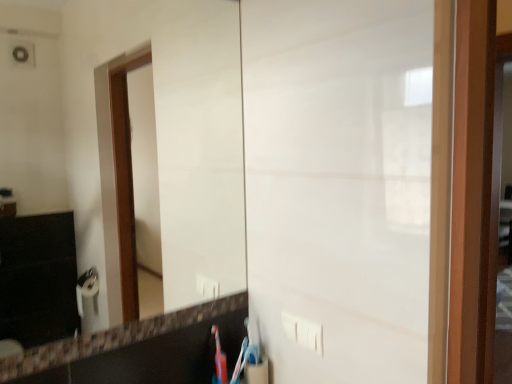
Question: From a real-world perspective, is blue plastic toothbrush at lower center located higher than white plastic electric outlet at lower center?

Choices:
 (A) yes
 (B) no

Answer: (B)

Question: Is blue plastic toothbrush at lower center far from white plastic electric outlet at lower center?

Choices:
 (A) no
 (B) yes

Answer: (A)

Question: Considering the relative positions of blue plastic toothbrush at lower center and white plastic electric outlet at lower center in the image provided, is blue plastic toothbrush at lower center to the left of white plastic electric outlet at lower center from the viewer's perspective?

Choices:
 (A) yes
 (B) no

Answer: (A)

Question: Considering the relative sizes of blue plastic toothbrush at lower center and white plastic electric outlet at lower center in the image provided, is blue plastic toothbrush at lower center bigger than white plastic electric outlet at lower center?

Choices:
 (A) no
 (B) yes

Answer: (A)

Question: Is blue plastic toothbrush at lower center positioned beyond the bounds of white plastic electric outlet at lower center?

Choices:
 (A) yes
 (B) no

Answer: (A)

Question: Considering the relative positions of white plastic electric outlet at lower center and white glossy mirror at center in the image provided, is white plastic electric outlet at lower center to the left or to the right of white glossy mirror at center?

Choices:
 (A) right
 (B) left

Answer: (A)

Question: Is white plastic electric outlet at lower center inside or outside of white glossy mirror at center?

Choices:
 (A) outside
 (B) inside

Answer: (A)

Question: Considering the positions of point (312, 340) and point (238, 345), is point (312, 340) closer or farther from the camera than point (238, 345)?

Choices:
 (A) farther
 (B) closer

Answer: (B)

Question: From the image's perspective, is white plastic electric outlet at lower center above or below white glossy mirror at center?

Choices:
 (A) above
 (B) below

Answer: (B)

Question: From a real-world perspective, is blue plastic toothbrush at lower center positioned above or below white plastic electric outlet at lower center?

Choices:
 (A) above
 (B) below

Answer: (B)

Question: Considering the positions of blue plastic toothbrush at lower center and white plastic electric outlet at lower center in the image, is blue plastic toothbrush at lower center wider or thinner than white plastic electric outlet at lower center?

Choices:
 (A) thin
 (B) wide

Answer: (B)

Question: Based on their sizes in the image, would you say blue plastic toothbrush at lower center is bigger or smaller than white plastic electric outlet at lower center?

Choices:
 (A) small
 (B) big

Answer: (A)

Question: Is blue plastic toothbrush at lower center inside or outside of white plastic electric outlet at lower center?

Choices:
 (A) outside
 (B) inside

Answer: (A)

Question: In terms of width, does white plastic electric outlet at lower center look wider or thinner when compared to blue plastic toothbrush at lower center?

Choices:
 (A) thin
 (B) wide

Answer: (A)

Question: Is white plastic electric outlet at lower center inside or outside of blue plastic toothbrush at lower center?

Choices:
 (A) inside
 (B) outside

Answer: (B)